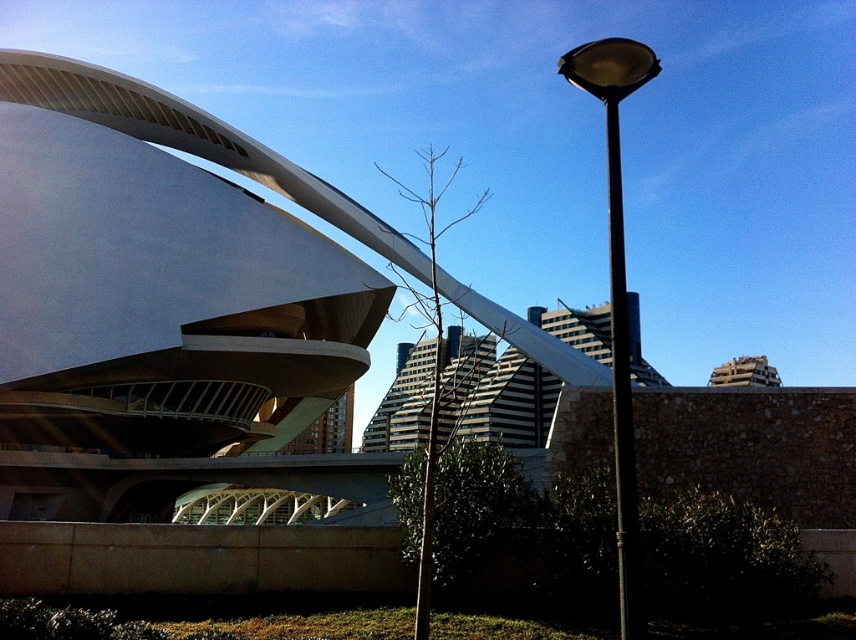
From the picture: You are standing in front of the scene and see the black metal pole at upper right and the black metal pole at right. Which pole is positioned more to the left side of the image?

The black metal pole at upper right is positioned more to the left side of the image compared to the black metal pole at right.

You are standing in front of the scene and see the black metal pole at upper right and the black metal pole at right. Which one is positioned higher from the ground?

The black metal pole at right is positioned higher from the ground than the black metal pole at upper right because the black metal pole at upper right is located below it.